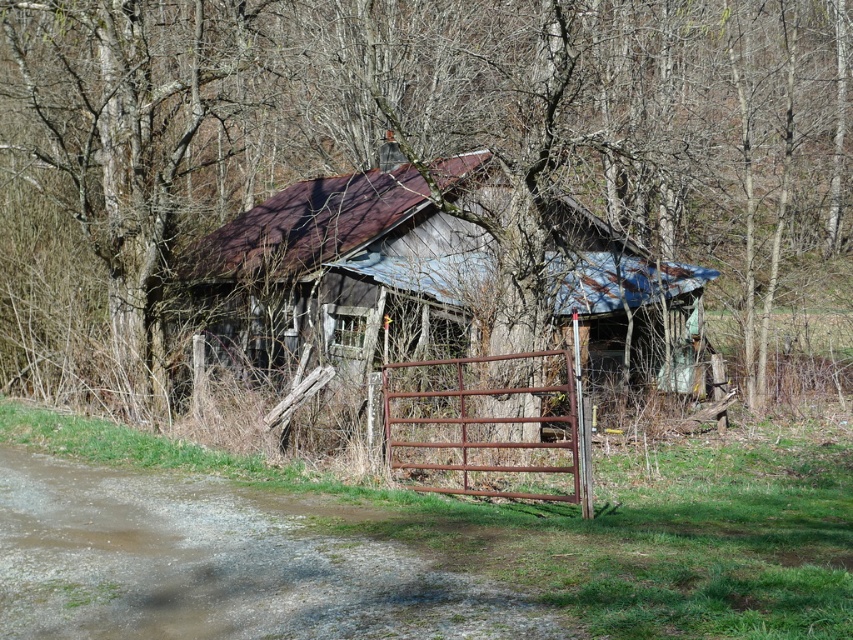
You are a maintenance worker tasked with repairing the rusty metal hut at center and the rusty metal gate at center. You have a limited amount of rustproofing material. Which object should you prioritize treating first based on their sizes?

The rusty metal hut at center has a larger size compared to the rusty metal gate at center, so you should prioritize treating the rusty metal hut at center first since it requires more rustproofing material.

You are standing at the entrance of the old shed and notice a point marked at coordinates (445,125). What object is located at this point?

The point at coordinates (445,125) corresponds to the brown wood tree at center.